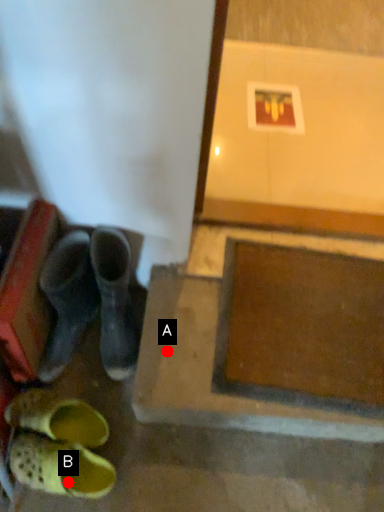
Question: Two points are circled on the image, labeled by A and B beside each circle. Which point is further to the camera?

Choices:
 (A) A is further
 (B) B is further

Answer: (A)